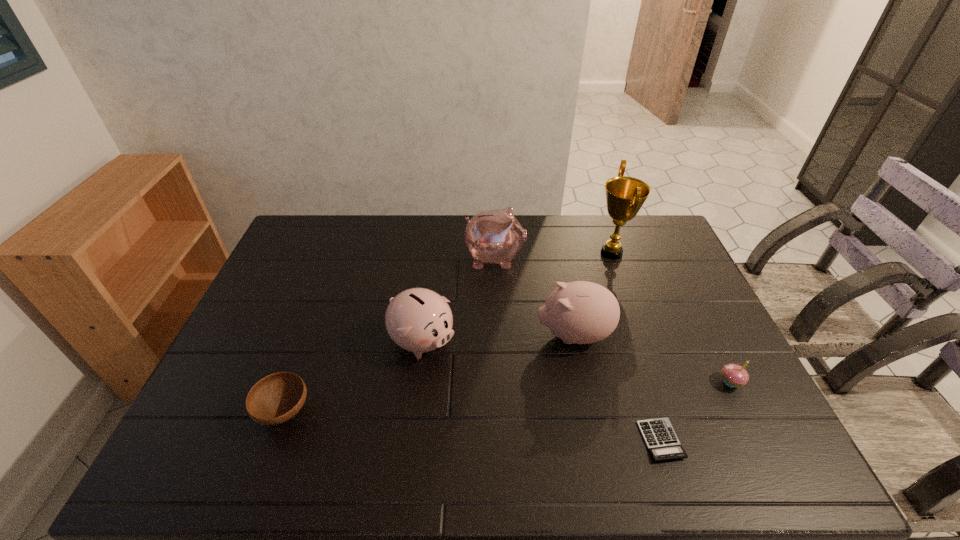
Where is `award`? award is located at coordinates (625, 196).

Find the location of a particular element. The image size is (960, 540). the second piggy bank from right to left is located at coordinates [495, 236].

Image resolution: width=960 pixels, height=540 pixels. What are the coordinates of `the farthest piggy bank` in the screenshot? It's located at (495, 236).

At what (x,y) coordinates should I click in order to perform the action: click on the rightmost piggy bank. Please return your answer as a coordinate pair (x, y). Looking at the image, I should click on (581, 312).

Identify the location of the sixth object from right to left. The height and width of the screenshot is (540, 960). (419, 320).

Locate an element on the screen. This screenshot has width=960, height=540. the rightmost object is located at coordinates (734, 375).

Identify the location of cupcake. This screenshot has height=540, width=960. (734, 375).

The image size is (960, 540). I want to click on the leftmost object, so click(x=276, y=398).

You are a GUI agent. You are given a task and a screenshot of the screen. Output one action in this format:
    pyautogui.click(x=<x>, y=<y>)
    Task: Click on the bowl
    
    Given the screenshot: What is the action you would take?
    pyautogui.click(x=276, y=398)

This screenshot has width=960, height=540. Identify the location of calculator. (661, 440).